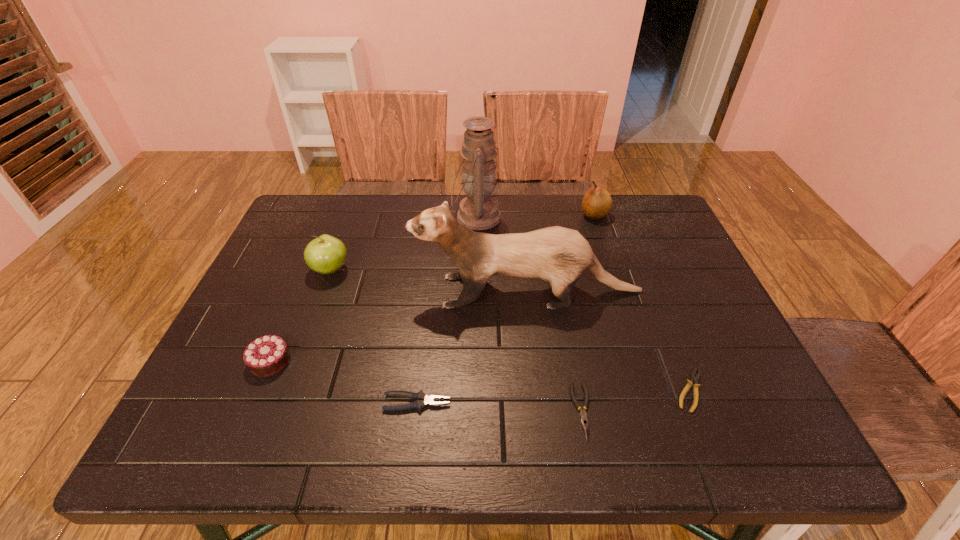
Find the location of a particular element. The height and width of the screenshot is (540, 960). oil lamp is located at coordinates (478, 210).

Where is `ferret`? The image size is (960, 540). ferret is located at coordinates (558, 255).

You are a GUI agent. You are given a task and a screenshot of the screen. Output one action in this format:
    pyautogui.click(x=<x>, y=<y>)
    Task: Click on the pear
    This screenshot has width=960, height=540.
    Given the screenshot: What is the action you would take?
    pyautogui.click(x=597, y=203)

Find the location of a particular element. apple is located at coordinates (326, 254).

Locate an element on the screen. The image size is (960, 540). chocolate cake is located at coordinates (268, 355).

Find the location of a particular element. the tallest pliers is located at coordinates (422, 400).

Find the location of a particular element. This screenshot has height=540, width=960. the sixth tallest object is located at coordinates (422, 400).

Identify the location of the second pliers from right to left. The height and width of the screenshot is (540, 960). (583, 415).

You are a GUI agent. You are given a task and a screenshot of the screen. Output one action in this format:
    pyautogui.click(x=<x>, y=<y>)
    Task: Click on the second shortest object
    This screenshot has width=960, height=540.
    Given the screenshot: What is the action you would take?
    pyautogui.click(x=583, y=415)

Find the location of a particular element. This screenshot has width=960, height=540. the shortest object is located at coordinates (695, 377).